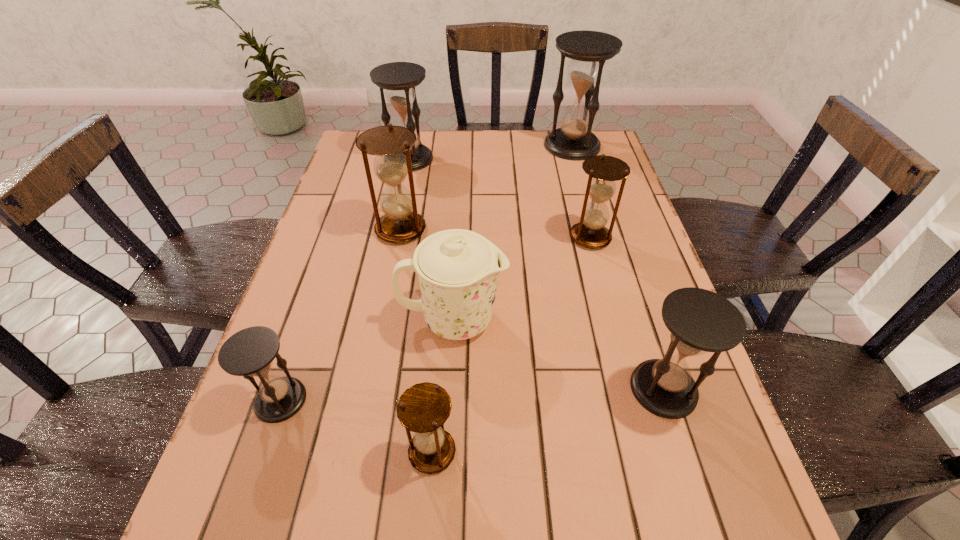
Find the location of a particular element. This screenshot has width=960, height=540. the tallest object is located at coordinates (588, 50).

Find the location of `the biggest black hourglass`. the biggest black hourglass is located at coordinates (588, 50).

Locate an element on the screen. The image size is (960, 540). the third black hourglass from right to left is located at coordinates (399, 79).

At what (x,y) coordinates should I click in order to perform the action: click on the biggest brown hourglass. Please return your answer as a coordinate pair (x, y). Image resolution: width=960 pixels, height=540 pixels. Looking at the image, I should click on (401, 223).

The height and width of the screenshot is (540, 960). Identify the location of chinaware. (458, 270).

I want to click on the second smallest black hourglass, so click(x=700, y=321).

Identify the location of the rightmost brown hourglass. Image resolution: width=960 pixels, height=540 pixels. (590, 232).

Identify the location of the leftmost object. Image resolution: width=960 pixels, height=540 pixels. (250, 352).

Identify the location of the smallest black hourglass. (250, 352).

I want to click on the nearest hourglass, so click(423, 408).